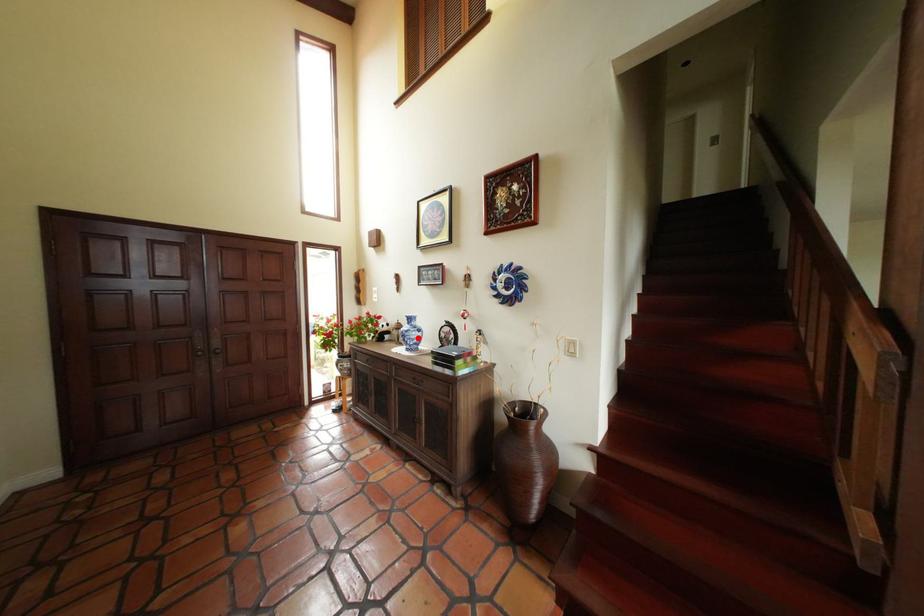
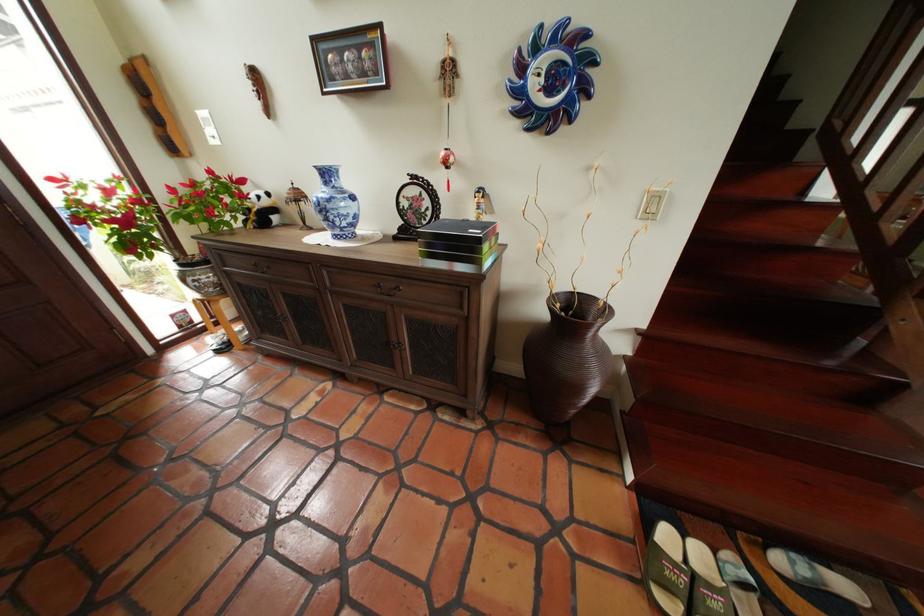
Question: I am providing you with two images of the same scene from different viewpoints. A red point is marked on the first image. Can you still see the location of the red point in image 2?

Choices:
 (A) Yes
 (B) No

Answer: (A)